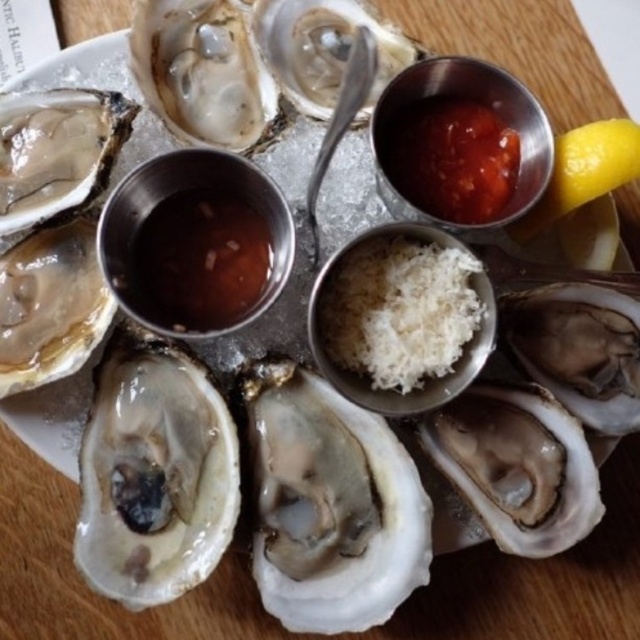
Consider the image. You are a food critic standing at a distance of 1 meter from the plate of oysters. You want to reach the point at coordinates point (419,317) to taste the oyster there. Can you comfortably reach it without moving your position?

The distance between you and point (419,317) is 87.06 centimeters, which is less than your 1 meter distance from the plate. Therefore, you can comfortably reach the oyster at point (419,317) without moving.

You are a food critic who wants to describe the location of the point marked at coordinates (397, 310) in the image. Based on the scene provided, what is the object at that point?

The point at coordinates (397, 310) is located on the white shredded cheese at center.